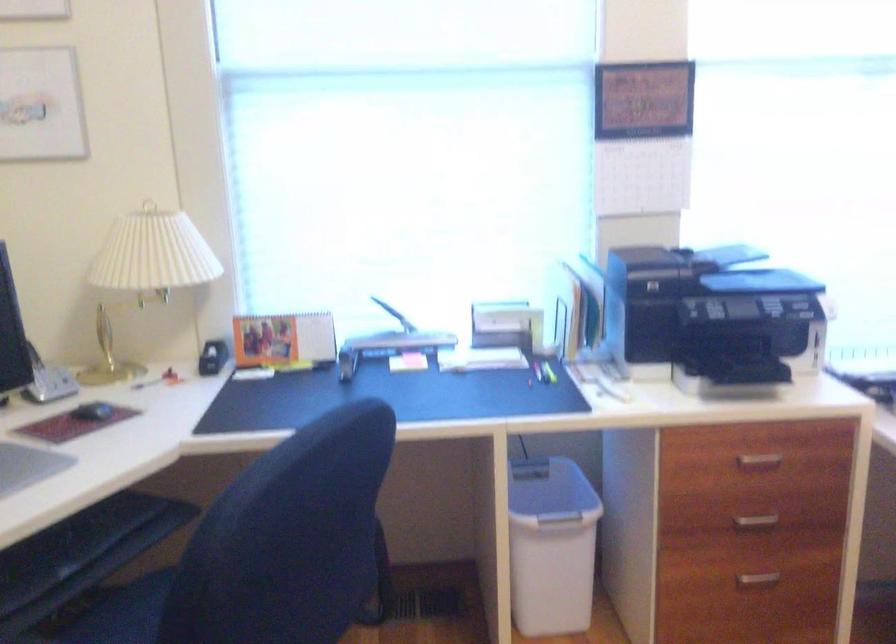
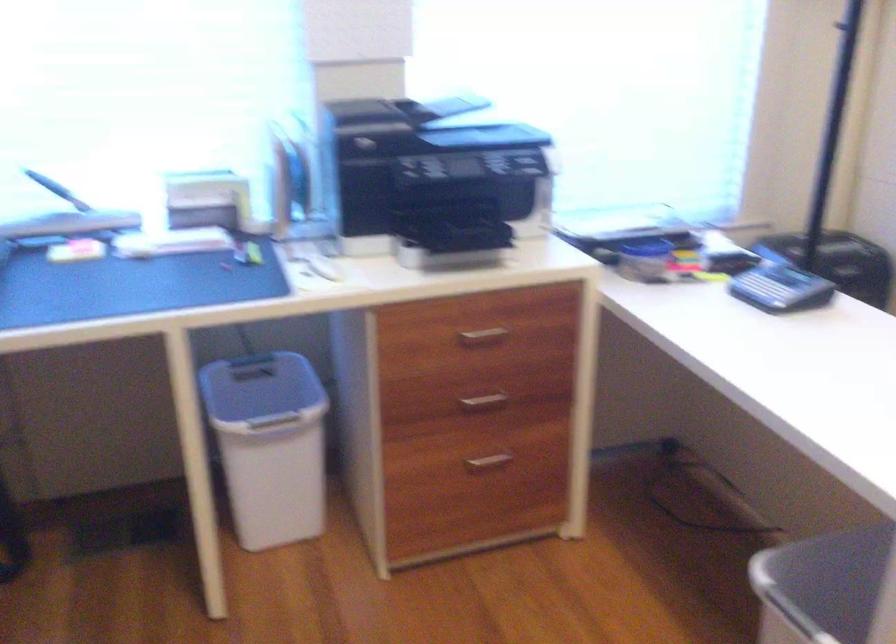
Question: The first image is from the beginning of the video and the second image is from the end. How did the camera likely rotate when shooting the video?

Choices:
 (A) Left
 (B) Right
 (C) Up
 (D) Down

Answer: (B)